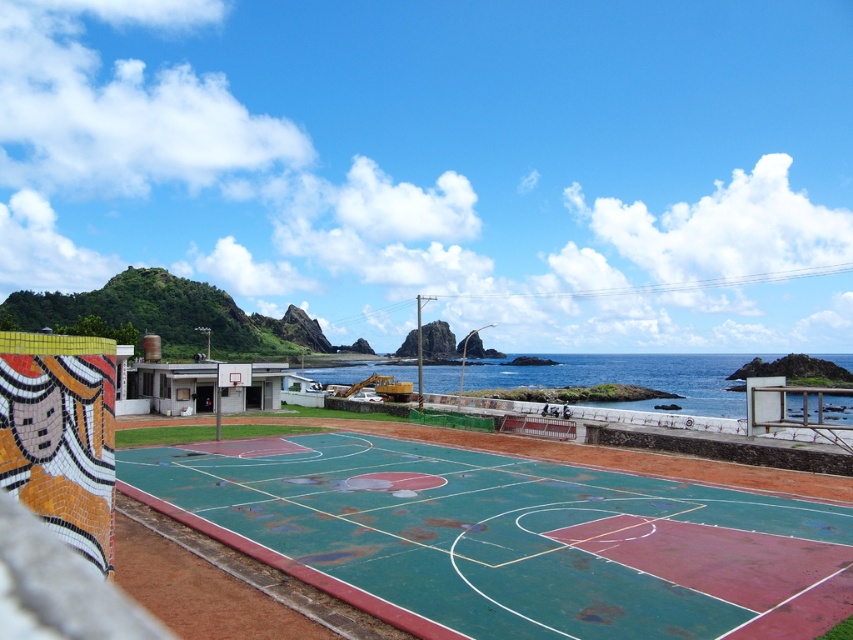
Does blue water at center come in front of metallic silver basketball hoop at center?

Yes, it is in front of metallic silver basketball hoop at center.

Image resolution: width=853 pixels, height=640 pixels. In order to click on blue water at center in this screenshot , I will do `click(630, 378)`.

Does green rubber basketball court at center appear on the left side of metallic silver basketball hoop at center?

In fact, green rubber basketball court at center is to the right of metallic silver basketball hoop at center.

Who is positioned more to the right, green rubber basketball court at center or metallic silver basketball hoop at center?

From the viewer's perspective, green rubber basketball court at center appears more on the right side.

Find the location of `green rubber basketball court at center`. green rubber basketball court at center is located at coordinates (509, 538).

The width and height of the screenshot is (853, 640). Describe the element at coordinates (509, 538) in the screenshot. I see `green rubber basketball court at center` at that location.

Can you confirm if green rubber basketball court at center is positioned to the left of blue water at center?

Indeed, green rubber basketball court at center is positioned on the left side of blue water at center.

Locate an element on the screen. green rubber basketball court at center is located at coordinates (509, 538).